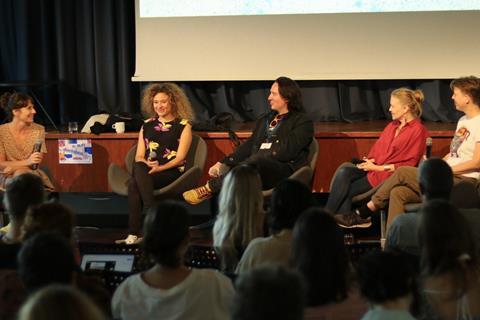
Identify the location of screen. (290, 38).